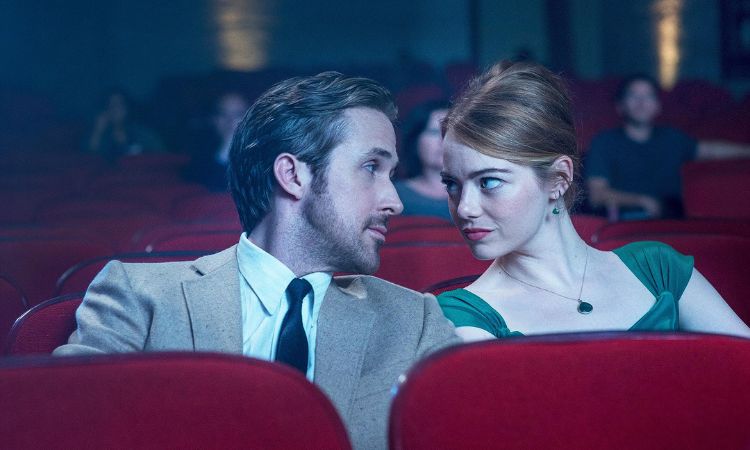
Identify the location of seats in a theater. (208, 421), (542, 398), (714, 250), (728, 185), (50, 256).